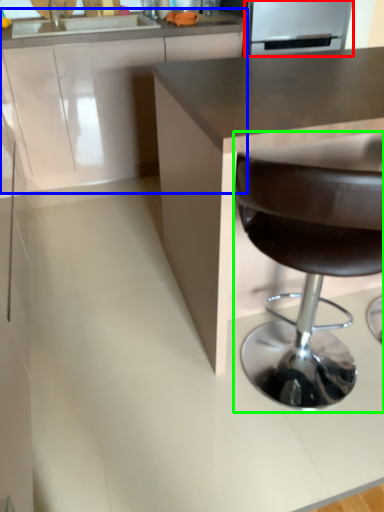
Question: Which object is the closest to the appliance (highlighted by a red box)? Choose among these: cabinetry (highlighted by a blue box) or chair (highlighted by a green box).

Choices:
 (A) cabinetry
 (B) chair

Answer: (A)